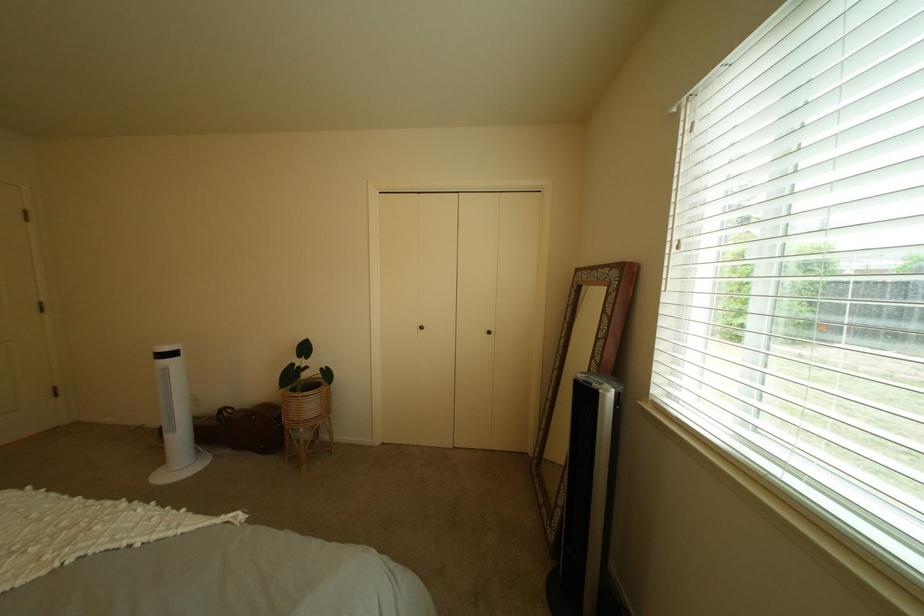
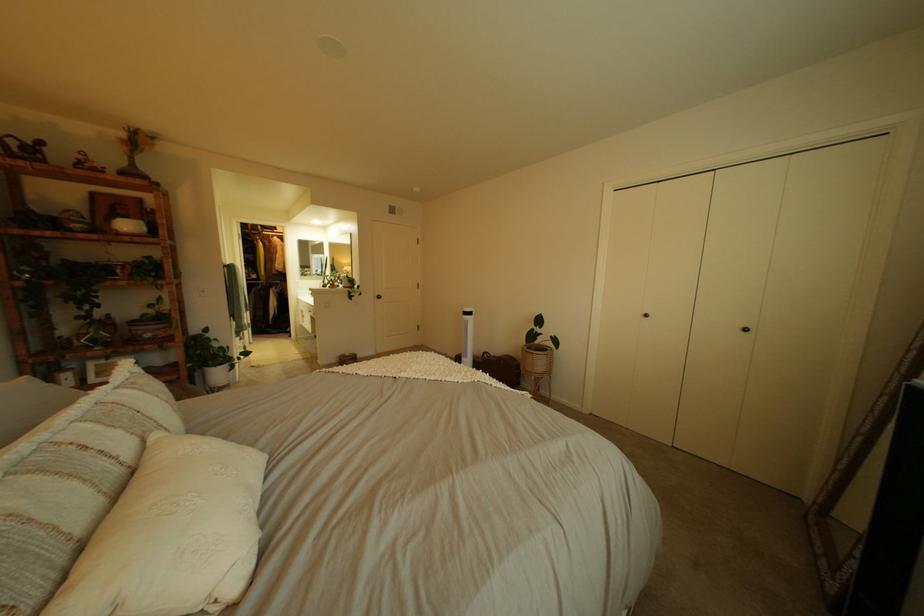
Find the pixel in the second image that matches pixel 155 511 in the first image.

(504, 376)